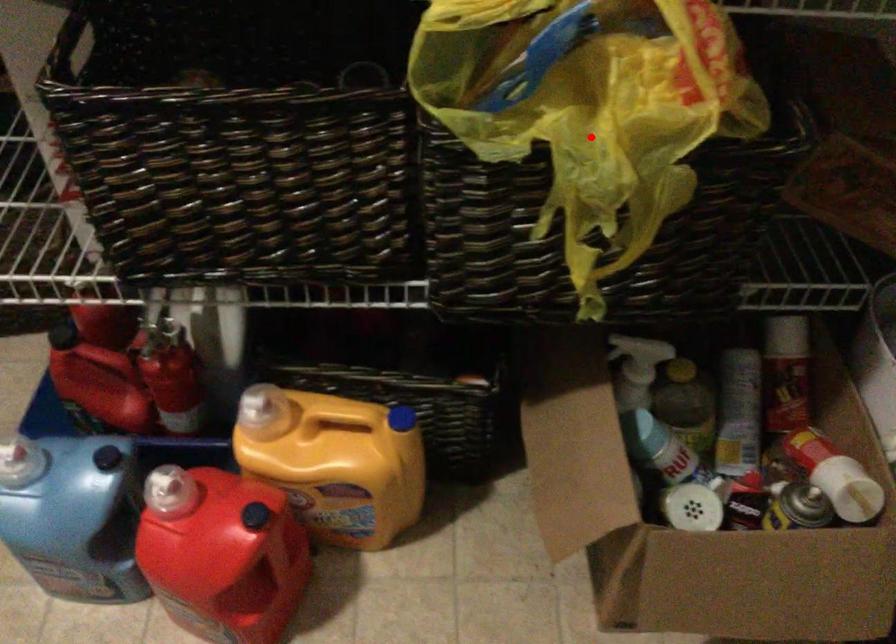
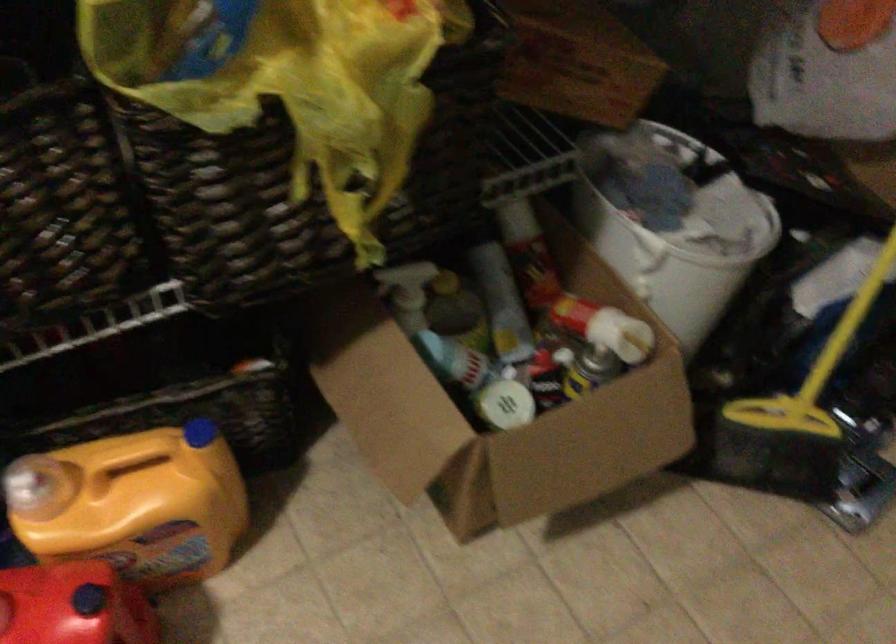
Find the pixel in the second image that matches the highlighted location in the first image.

(323, 84)